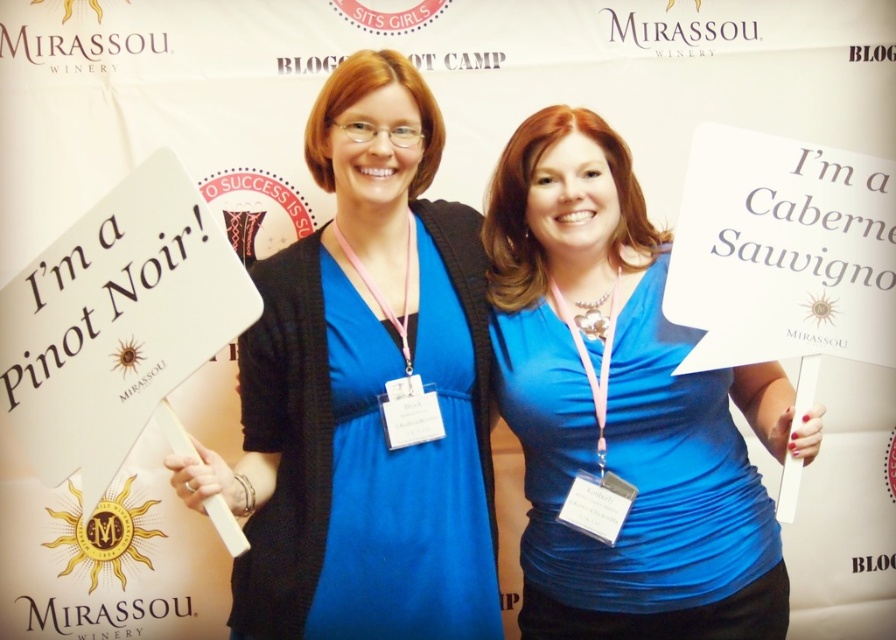
Does blue matte dress at center come in front of matte blue shirt at center?

Yes, it is in front of matte blue shirt at center.

Where is `blue matte dress at center`? blue matte dress at center is located at coordinates (364, 392).